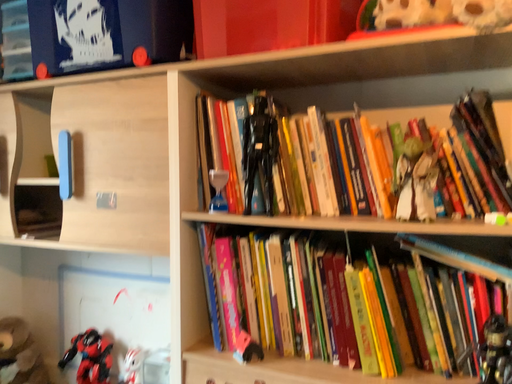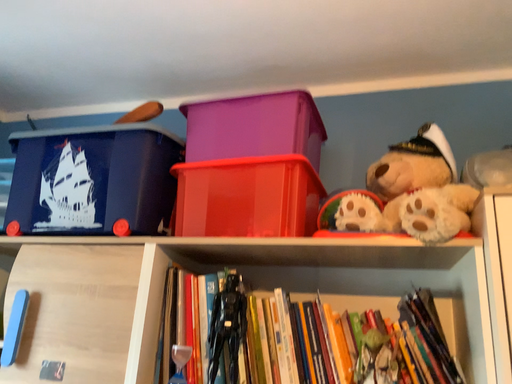
Question: How did the camera likely rotate when shooting the video?

Choices:
 (A) rotated right
 (B) rotated left

Answer: (A)